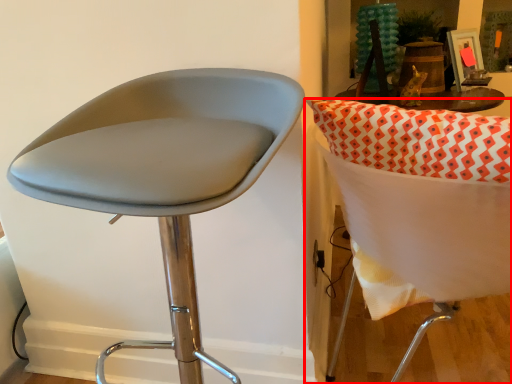
Question: Observing the image, what is the correct spatial positioning of chair (annotated by the red box) in reference to chair?

Choices:
 (A) left
 (B) right

Answer: (B)